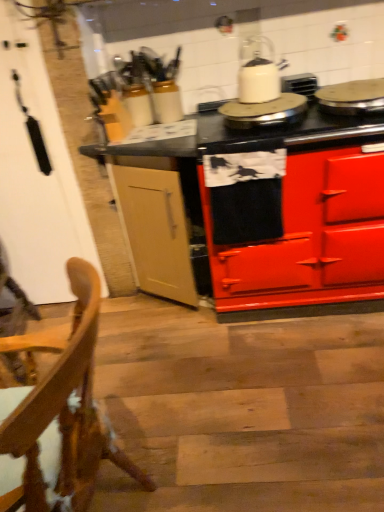
Question: Is point (286, 117) closer or farther from the camera than point (266, 38)?

Choices:
 (A) closer
 (B) farther

Answer: (A)

Question: From their relative heights in the image, would you say white glossy kettle at upper center, acting as the 2th appliance starting from the right, is taller or shorter than white glossy kettle at upper center?

Choices:
 (A) tall
 (B) short

Answer: (B)

Question: Which object is the farthest from the wooden chair at lower left?

Choices:
 (A) red glossy stove at center
 (B) white glossy kettle at upper center
 (C) white glossy kettle at upper center, acting as the 2th appliance starting from the right
 (D) metallic silver pan at upper right, placed as the 2th appliance when sorted from left to right

Answer: (D)

Question: Based on their relative distances, which object is nearer to the white glossy kettle at upper center, the first appliance positioned from the left?

Choices:
 (A) red glossy stove at center
 (B) wooden chair at lower left
 (C) metallic silver pan at upper right, which ranks as the first appliance in right-to-left order
 (D) white glossy kettle at upper center

Answer: (D)